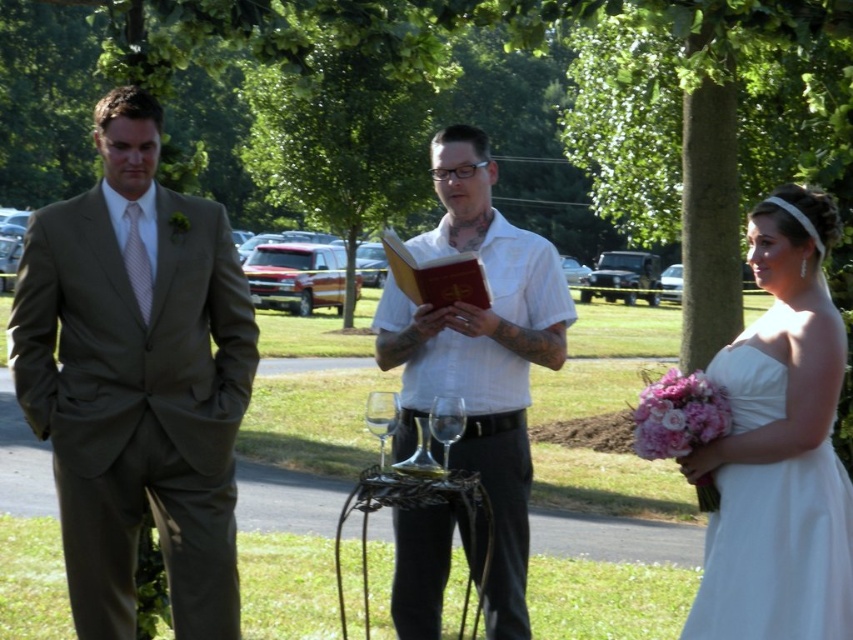
Is matte brown suit at left smaller than white satin dress at right?

Incorrect, matte brown suit at left is not smaller in size than white satin dress at right.

Is point (221, 548) positioned after point (755, 422)?

Yes, point (221, 548) is behind point (755, 422).

Image resolution: width=853 pixels, height=640 pixels. Describe the element at coordinates (137, 380) in the screenshot. I see `matte brown suit at left` at that location.

This screenshot has height=640, width=853. I want to click on matte brown suit at left, so click(x=137, y=380).

Is white matte shirt at center bigger than transparent glass wine glass at center?

Indeed, white matte shirt at center has a larger size compared to transparent glass wine glass at center.

Which is in front, point (457, 129) or point (436, 440)?

Point (436, 440) is in front.

The image size is (853, 640). Identify the location of white matte shirt at center. (480, 353).

Which is more to the left, transparent glass wine glass at center or clear glass wine glass at center?

From the viewer's perspective, clear glass wine glass at center appears more on the left side.

Based on the photo, can you confirm if transparent glass wine glass at center is wider than clear glass wine glass at center?

Yes, transparent glass wine glass at center is wider than clear glass wine glass at center.

Identify the location of transparent glass wine glass at center. This screenshot has height=640, width=853. (445, 422).